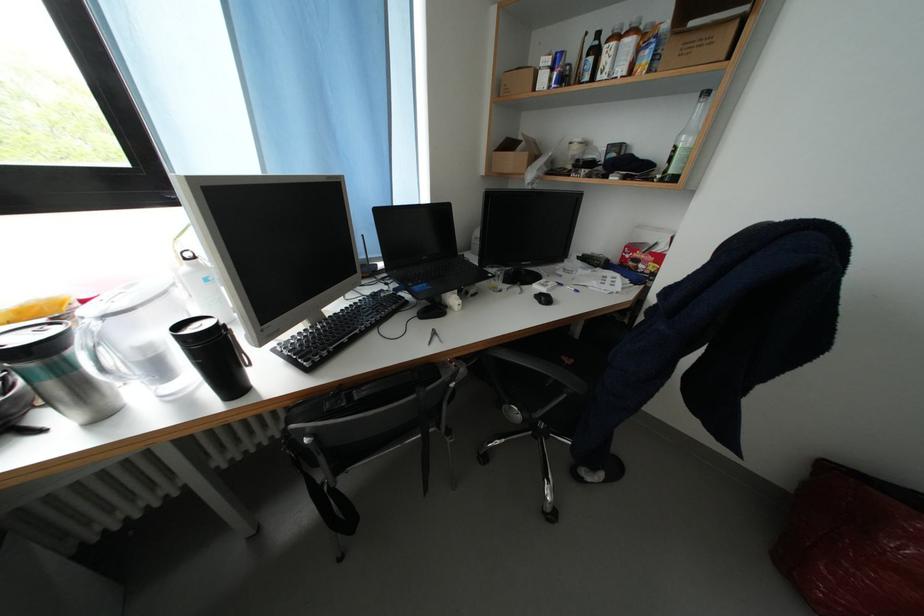
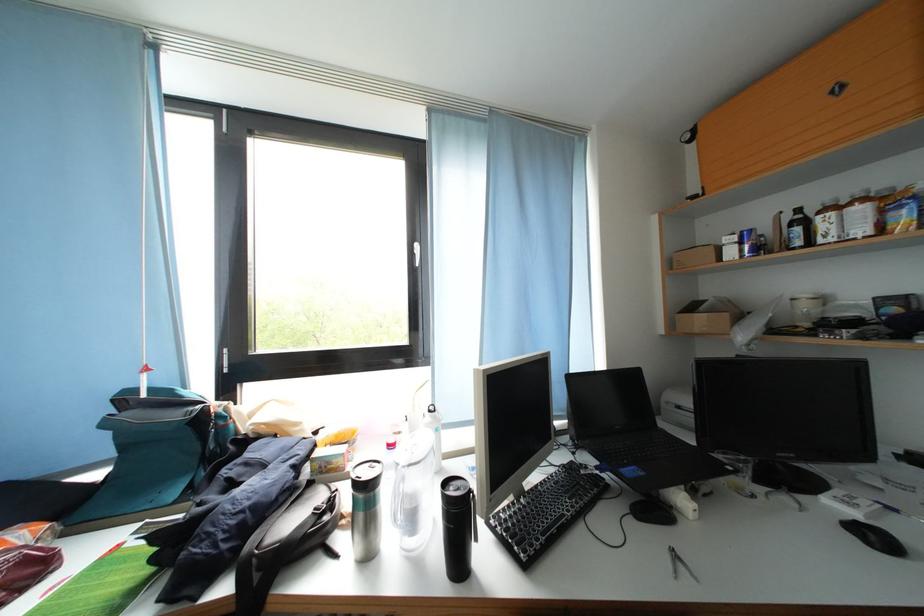
Find the pixel in the second image that matches [604,55] in the first image.

(812, 227)